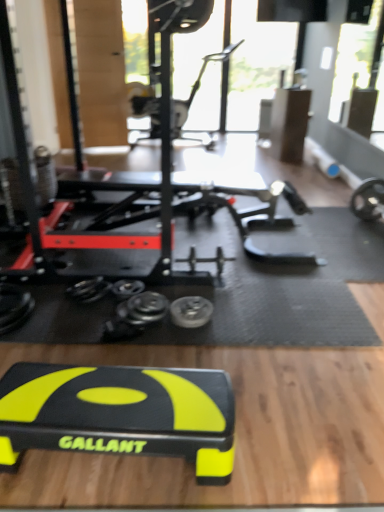
Locate an element on the screen. blank space situated above metallic silver weight at center (from a real-world perspective) is located at coordinates (190, 307).